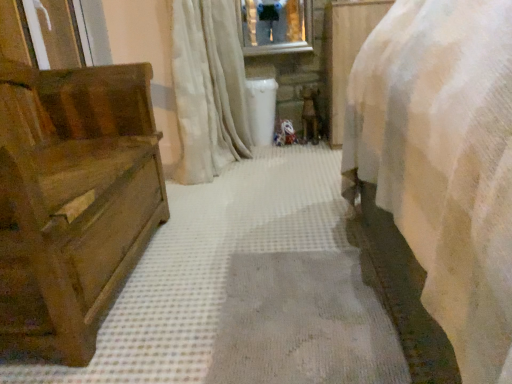
The height and width of the screenshot is (384, 512). What do you see at coordinates (208, 88) in the screenshot?
I see `white soft curtain at center` at bounding box center [208, 88].

Where is `white soft curtain at center`? The height and width of the screenshot is (384, 512). white soft curtain at center is located at coordinates (208, 88).

What is the approximate width of white soft curtain at center?

white soft curtain at center is 44.66 centimeters in width.

You are a GUI agent. You are given a task and a screenshot of the screen. Output one action in this format:
    pyautogui.click(x=<x>, y=<y>)
    Task: Click on the wooden chest at left
    
    Given the screenshot: What is the action you would take?
    pyautogui.click(x=72, y=199)

What do you see at coordinates (72, 199) in the screenshot? I see `wooden chest at left` at bounding box center [72, 199].

I want to click on white soft curtain at center, so click(208, 88).

Considering the relative positions of white soft curtain at center and wooden chest at left in the image provided, is white soft curtain at center to the right of wooden chest at left from the viewer's perspective?

Yes, white soft curtain at center is to the right of wooden chest at left.

Is white soft curtain at center closer to camera compared to wooden chest at left?

No, it is behind wooden chest at left.

Does point (222, 138) lie behind point (12, 197)?

Yes, it is.

From the image's perspective, is white soft curtain at center located beneath wooden chest at left?

No, from the image's perspective, white soft curtain at center is not beneath wooden chest at left.

From a real-world perspective, is white soft curtain at center on wooden chest at left?

Correct, in the physical world, white soft curtain at center is higher than wooden chest at left.

Can you confirm if white soft curtain at center is wider than wooden chest at left?

Incorrect, the width of white soft curtain at center does not surpass that of wooden chest at left.

Looking at this image, is white soft curtain at center taller than wooden chest at left?

Yes, white soft curtain at center is taller than wooden chest at left.

Which of these two, white soft curtain at center or wooden chest at left, is smaller?

With smaller size is white soft curtain at center.

From the picture: Is wooden chest at left a part of white soft curtain at center?

Definitely not — wooden chest at left is not inside white soft curtain at center.

Are white soft curtain at center and wooden chest at left located far from each other?

No, white soft curtain at center is not far from wooden chest at left.

Could you tell me if white soft curtain at center is turned towards wooden chest at left?

No, white soft curtain at center is not aimed at wooden chest at left.

Find the location of a particular element. This screenshot has height=384, width=512. furniture lying below the white soft curtain at center (from the image's perspective) is located at coordinates (72, 199).

Is wooden chest at left at the right side of white soft curtain at center?

No, wooden chest at left is not to the right of white soft curtain at center.

Considering the positions of objects wooden chest at left and white soft curtain at center in the image provided, who is in front, wooden chest at left or white soft curtain at center?

wooden chest at left is in front.

Considering the positions of points (50, 310) and (219, 27), is point (50, 310) closer to camera compared to point (219, 27)?

Yes, point (50, 310) is closer to viewer.

Looking at this image, from the image's perspective, is wooden chest at left above or below white soft curtain at center?

Clearly, from the image's perspective, wooden chest at left is below white soft curtain at center.

From a real-world perspective, between wooden chest at left and white soft curtain at center, who is vertically lower?

wooden chest at left is physically lower.

Is wooden chest at left wider or thinner than white soft curtain at center?

wooden chest at left is wider than white soft curtain at center.

Who is taller, wooden chest at left or white soft curtain at center?

white soft curtain at center is taller.

Considering the sizes of objects wooden chest at left and white soft curtain at center in the image provided, who is bigger, wooden chest at left or white soft curtain at center?

wooden chest at left is bigger.

Which is correct: wooden chest at left is inside white soft curtain at center, or outside of it?

wooden chest at left exists outside the volume of white soft curtain at center.

Consider the image. Is wooden chest at left next to white soft curtain at center?

No.

Is wooden chest at left oriented towards white soft curtain at center?

No, wooden chest at left is not oriented towards white soft curtain at center.

How far apart are wooden chest at left and white soft curtain at center?

wooden chest at left is 29.99 inches from white soft curtain at center.

Locate an element on the screen. Image resolution: width=512 pixels, height=384 pixels. curtain behind the wooden chest at left is located at coordinates (x=208, y=88).

Locate an element on the screen. This screenshot has height=384, width=512. curtain that is behind the wooden chest at left is located at coordinates pyautogui.click(x=208, y=88).

Where is `furniture on the left of white soft curtain at center`? furniture on the left of white soft curtain at center is located at coordinates (72, 199).